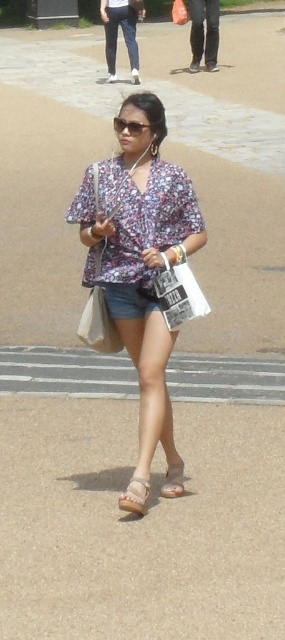
Is floral fabric blouse at center to the left of white paper bag at center from the viewer's perspective?

Indeed, floral fabric blouse at center is positioned on the left side of white paper bag at center.

Which is more to the right, floral fabric blouse at center or white paper bag at center?

Positioned to the right is white paper bag at center.

The height and width of the screenshot is (640, 285). In order to click on floral fabric blouse at center in this screenshot , I will do `click(137, 205)`.

Can you confirm if light beige suede sandal at lower center is wider than brown leather sandal at lower center?

Correct, the width of light beige suede sandal at lower center exceeds that of brown leather sandal at lower center.

Who is positioned more to the left, light beige suede sandal at lower center or brown leather sandal at lower center?

From the viewer's perspective, light beige suede sandal at lower center appears more on the left side.

Is point (119, 502) in front of point (178, 496)?

Yes, point (119, 502) is in front of point (178, 496).

Locate an element on the screen. The width and height of the screenshot is (285, 640). light beige suede sandal at lower center is located at coordinates (135, 497).

How distant is floral fabric blouse at center from brown leather sandal at lower center?

floral fabric blouse at center is 69.35 centimeters from brown leather sandal at lower center.

Which is behind, point (155, 193) or point (174, 486)?

Positioned behind is point (174, 486).

Who is more distant from viewer, (123, 227) or (167, 493)?

Point (167, 493)

The width and height of the screenshot is (285, 640). In order to click on floral fabric blouse at center in this screenshot , I will do `click(137, 205)`.